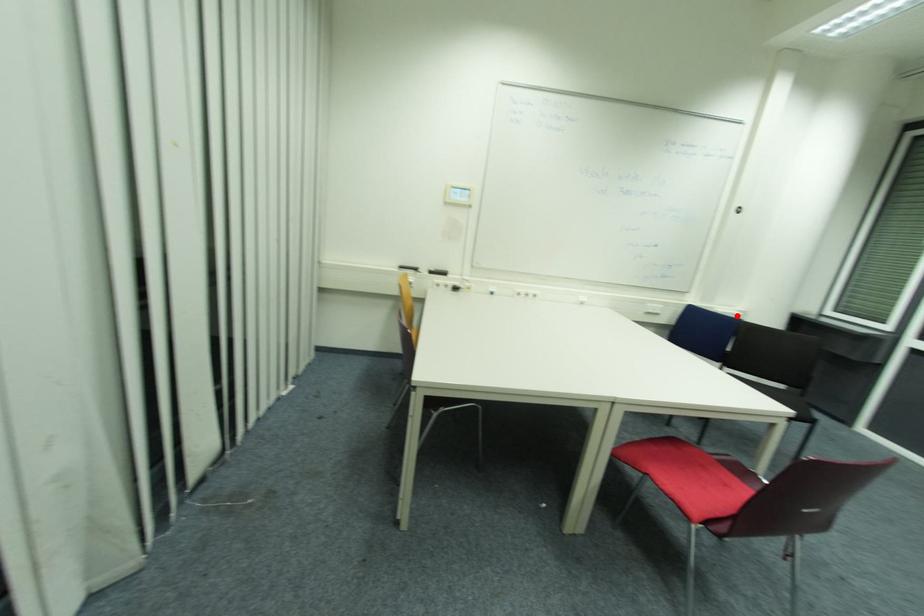
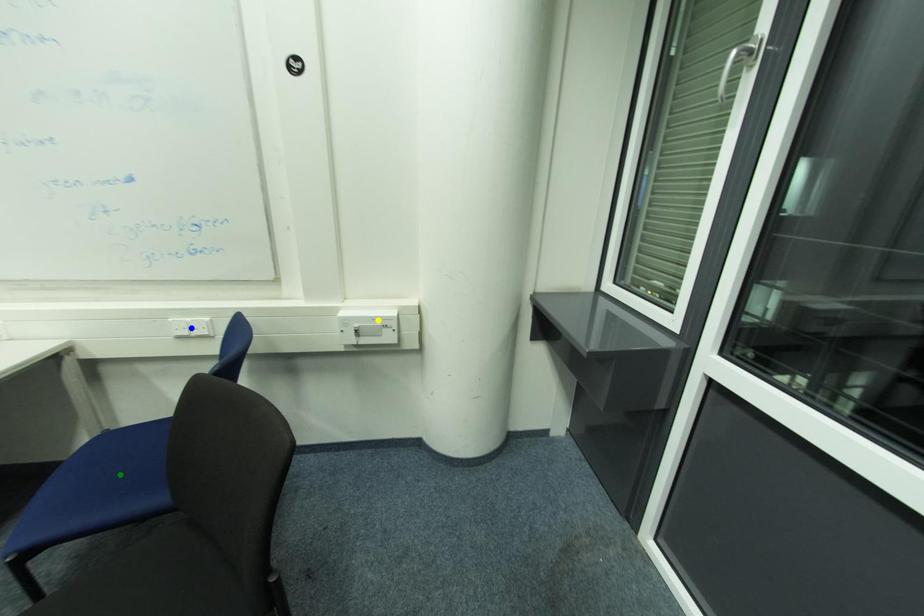
Question: I am providing you with two images of the same scene from different viewpoints. A red point is marked on the first image. You are given multiple points on the second image. Can you choose the point in image 2 that corresponds to the point in image 1?

Choices:
 (A) yellow point
 (B) green point
 (C) blue point

Answer: (A)